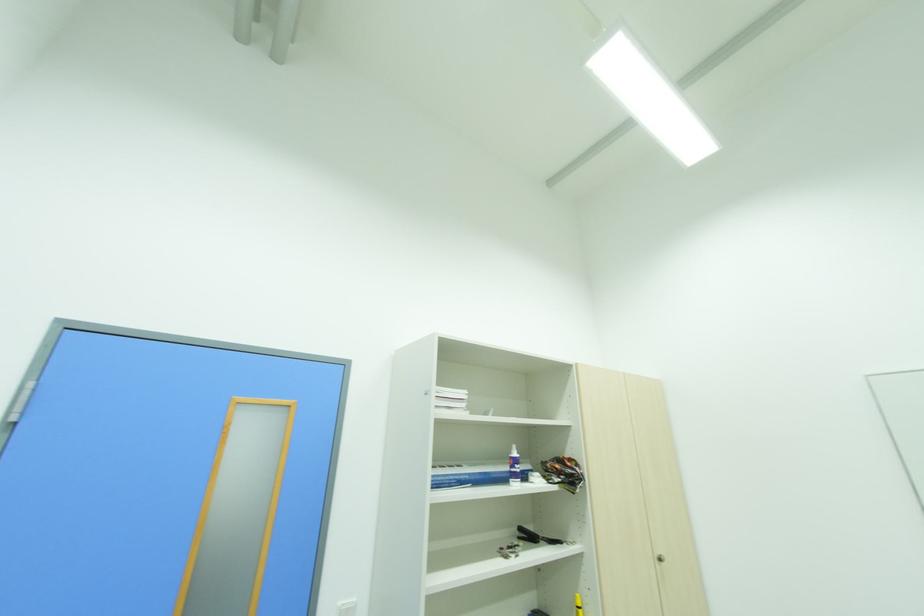
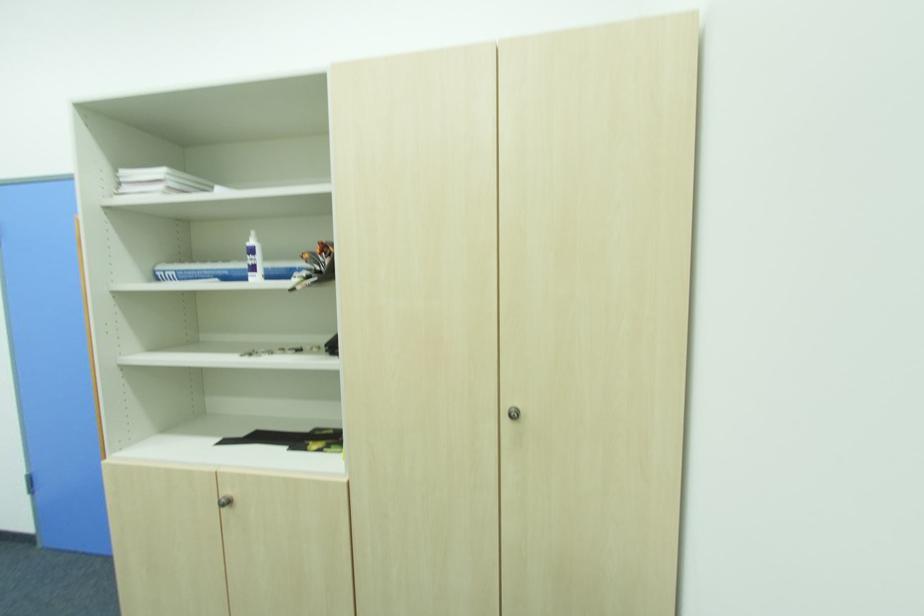
The point at [465,394] is marked in the first image. Where is the corresponding point in the second image?

(161, 172)